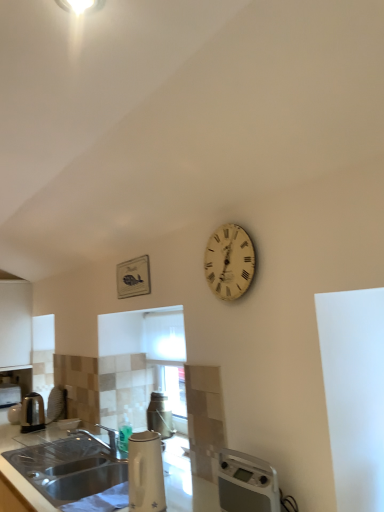
Question: Is white wooden clock at upper right located within white matte cabinet at left?

Choices:
 (A) no
 (B) yes

Answer: (A)

Question: Does white matte cabinet at left come behind white wooden clock at upper right?

Choices:
 (A) no
 (B) yes

Answer: (B)

Question: From the image's perspective, is white matte cabinet at left beneath white wooden clock at upper right?

Choices:
 (A) no
 (B) yes

Answer: (B)

Question: Does white matte cabinet at left have a lesser height compared to white wooden clock at upper right?

Choices:
 (A) yes
 (B) no

Answer: (B)

Question: Considering the relative positions of white matte cabinet at left and white wooden clock at upper right in the image provided, is white matte cabinet at left to the left of white wooden clock at upper right from the viewer's perspective?

Choices:
 (A) yes
 (B) no

Answer: (A)

Question: Considering the positions of white matte cabinet at left and white glossy electric kettle at lower center in the image, is white matte cabinet at left taller or shorter than white glossy electric kettle at lower center?

Choices:
 (A) short
 (B) tall

Answer: (B)

Question: From the image's perspective, is white matte cabinet at left above or below white glossy electric kettle at lower center?

Choices:
 (A) above
 (B) below

Answer: (A)

Question: In the image, is white matte cabinet at left positioned in front of or behind white glossy electric kettle at lower center?

Choices:
 (A) behind
 (B) front

Answer: (A)

Question: In terms of size, does white matte cabinet at left appear bigger or smaller than white glossy electric kettle at lower center?

Choices:
 (A) small
 (B) big

Answer: (B)

Question: From their relative heights in the image, would you say white matte cabinet at left is taller or shorter than white plastic water heater at lower right?

Choices:
 (A) tall
 (B) short

Answer: (A)

Question: Visually, is white matte cabinet at left positioned to the left or to the right of white plastic water heater at lower right?

Choices:
 (A) right
 (B) left

Answer: (B)

Question: Is white matte cabinet at left wider or thinner than white plastic water heater at lower right?

Choices:
 (A) wide
 (B) thin

Answer: (A)

Question: Considering the positions of point (8, 365) and point (236, 462), is point (8, 365) closer or farther from the camera than point (236, 462)?

Choices:
 (A) closer
 (B) farther

Answer: (B)

Question: Is white glossy countertop at lower left to the left or to the right of white wooden clock at upper right in the image?

Choices:
 (A) right
 (B) left

Answer: (B)

Question: From the image's perspective, is white glossy countertop at lower left located above or below white wooden clock at upper right?

Choices:
 (A) above
 (B) below

Answer: (B)